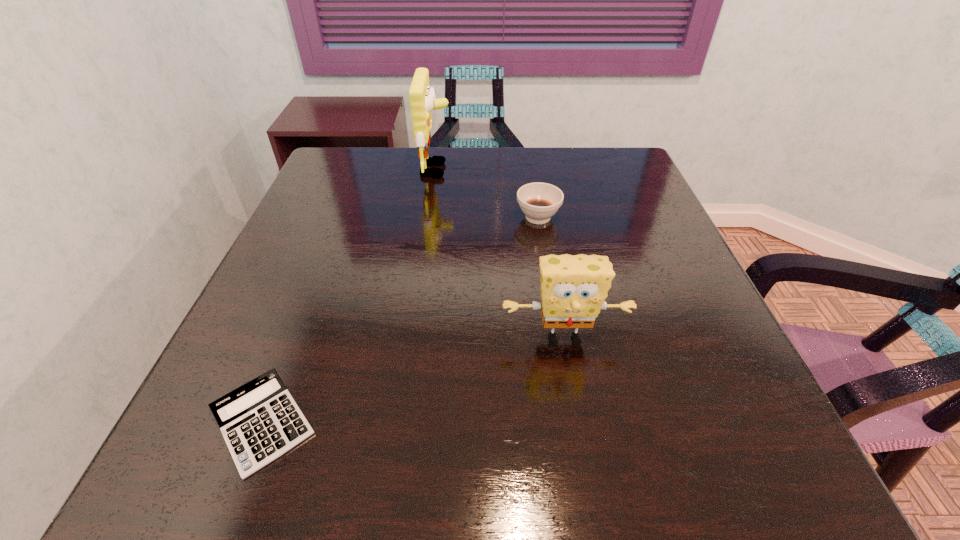
Identify the location of free space located 0.220m on the front of the second shortest object. (551, 295).

I want to click on free space located on the right of the leftmost object, so click(x=532, y=422).

Identify the location of object that is at the far edge. The width and height of the screenshot is (960, 540). point(422,96).

Image resolution: width=960 pixels, height=540 pixels. What are the coordinates of `object that is at the near edge` in the screenshot? It's located at (260, 421).

You are a GUI agent. You are given a task and a screenshot of the screen. Output one action in this format:
    pyautogui.click(x=<x>, y=<y>)
    Task: Click on the object at the left edge
    This screenshot has width=960, height=540.
    Given the screenshot: What is the action you would take?
    pyautogui.click(x=260, y=421)

Image resolution: width=960 pixels, height=540 pixels. What are the coordinates of `object at the near left corner` in the screenshot? It's located at (260, 421).

The width and height of the screenshot is (960, 540). Identify the location of vacant space at the far edge of the desktop. tap(481, 164).

In the image, there is a desktop. Find the location of `vacant region at the near edge`. vacant region at the near edge is located at coordinates (551, 445).

Where is `vacant space at the left edge`? This screenshot has height=540, width=960. vacant space at the left edge is located at coordinates 319,294.

You are a GUI agent. You are given a task and a screenshot of the screen. Output one action in this format:
    pyautogui.click(x=<x>, y=<y>)
    Task: Click on the free space at the right edge
    Image resolution: width=960 pixels, height=540 pixels.
    Given the screenshot: What is the action you would take?
    pyautogui.click(x=680, y=248)